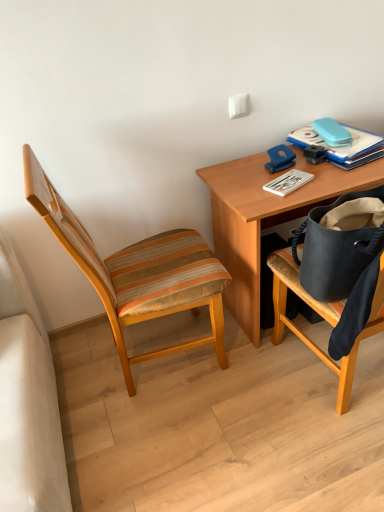
This screenshot has width=384, height=512. Describe the element at coordinates (265, 219) in the screenshot. I see `wooden desk at upper right` at that location.

What do you see at coordinates (137, 271) in the screenshot?
I see `wooden striped chair at left` at bounding box center [137, 271].

What are the coordinates of `wooden desk at upper right` in the screenshot? It's located at (265, 219).

Is point (157, 287) positioned after point (352, 139)?

That is False.

How many degrees apart are the facing directions of wooden striped chair at left and blue hardcover book at upper right, the first paperback book from the top?

They differ by 79.7 degrees in their facing directions.

Based on the photo, considering the sizes of objects wooden striped chair at left and blue hardcover book at upper right, placed as the 1th paperback book when sorted from right to left, in the image provided, who is thinner, wooden striped chair at left or blue hardcover book at upper right, placed as the 1th paperback book when sorted from right to left,?

Thinner between the two is blue hardcover book at upper right, placed as the 1th paperback book when sorted from right to left.

From a real-world perspective, is wooden striped chair at left above or below blue hardcover book at upper right, the first paperback book from the top?

wooden striped chair at left is below blue hardcover book at upper right, the first paperback book from the top.

Is blue hardcover book at upper right, placed as the 1th paperback book when sorted from right to left, facing towards white matte paperback book at upper right, positioned as the first paperback book in left-to-right order?

No, blue hardcover book at upper right, placed as the 1th paperback book when sorted from right to left, is not aimed at white matte paperback book at upper right, positioned as the first paperback book in left-to-right order.

Is blue hardcover book at upper right, placed as the 1th paperback book when sorted from right to left, further to the viewer compared to white matte paperback book at upper right, positioned as the first paperback book in left-to-right order?

Yes, blue hardcover book at upper right, placed as the 1th paperback book when sorted from right to left, is behind white matte paperback book at upper right, positioned as the first paperback book in left-to-right order.

From a real-world perspective, is blue hardcover book at upper right, the first paperback book from the top, below white matte paperback book at upper right, the second paperback book when ordered from right to left?

No, from a real-world perspective, blue hardcover book at upper right, the first paperback book from the top, is not beneath white matte paperback book at upper right, the second paperback book when ordered from right to left.

Does blue hardcover book at upper right, placed as the second paperback book when sorted from left to right, have a larger size compared to white matte paperback book at upper right, which is the 2th paperback book from top to bottom?

Yes, blue hardcover book at upper right, placed as the second paperback book when sorted from left to right, is bigger than white matte paperback book at upper right, which is the 2th paperback book from top to bottom.

Between white matte paperback book at upper right, which is the first paperback book from bottom to top, and wooden desk at upper right, which one appears on the left side from the viewer's perspective?

From the viewer's perspective, white matte paperback book at upper right, which is the first paperback book from bottom to top, appears more on the left side.

Does white matte paperback book at upper right, positioned as the first paperback book in left-to-right order, come behind wooden desk at upper right?

Yes, the depth of white matte paperback book at upper right, positioned as the first paperback book in left-to-right order, is greater than that of wooden desk at upper right.

Find the location of a particular element. The height and width of the screenshot is (512, 384). desk below the white matte paperback book at upper right, which is the 2th paperback book from top to bottom (from a real-world perspective) is located at coordinates (265, 219).

Consider the image. Between white matte paperback book at upper right, which is the first paperback book from bottom to top, and wooden desk at upper right, which one has larger size?

wooden desk at upper right.

Considering the relative sizes of white matte paperback book at upper right, which is the 2th paperback book from top to bottom, and blue hardcover book at upper right, placed as the second paperback book when sorted from left to right, in the image provided, is white matte paperback book at upper right, which is the 2th paperback book from top to bottom, taller than blue hardcover book at upper right, placed as the second paperback book when sorted from left to right,?

No, white matte paperback book at upper right, which is the 2th paperback book from top to bottom, is not taller than blue hardcover book at upper right, placed as the second paperback book when sorted from left to right.

Which object is positioned more to the left, white matte paperback book at upper right, positioned as the first paperback book in left-to-right order, or blue hardcover book at upper right, arranged as the 2th paperback book when ordered from the bottom?

From the viewer's perspective, white matte paperback book at upper right, positioned as the first paperback book in left-to-right order, appears more on the left side.

Is blue hardcover book at upper right, arranged as the 2th paperback book when ordered from the bottom, at the back of white matte paperback book at upper right, positioned as the first paperback book in left-to-right order?

No, blue hardcover book at upper right, arranged as the 2th paperback book when ordered from the bottom, is not at the back of white matte paperback book at upper right, positioned as the first paperback book in left-to-right order.

Considering the relative sizes of white matte paperback book at upper right, positioned as the first paperback book in left-to-right order, and wooden striped chair at left in the image provided, is white matte paperback book at upper right, positioned as the first paperback book in left-to-right order, taller than wooden striped chair at left?

Incorrect, the height of white matte paperback book at upper right, positioned as the first paperback book in left-to-right order, is not larger of that of wooden striped chair at left.

In the scene shown: From the image's perspective, does white matte paperback book at upper right, positioned as the first paperback book in left-to-right order, appear higher than wooden striped chair at left?

Yes, from the image's perspective, white matte paperback book at upper right, positioned as the first paperback book in left-to-right order, is on top of wooden striped chair at left.

How different are the orientations of white matte paperback book at upper right, positioned as the first paperback book in left-to-right order, and wooden striped chair at left in degrees?

The angular difference between white matte paperback book at upper right, positioned as the first paperback book in left-to-right order, and wooden striped chair at left is 20.1 degrees.

Which of these two, white matte paperback book at upper right, the second paperback book when ordered from right to left, or wooden striped chair at left, is bigger?

With larger size is wooden striped chair at left.

How different are the orientations of wooden desk at upper right and wooden striped chair at left in degrees?

The facing directions of wooden desk at upper right and wooden striped chair at left are 88.4 degrees apart.

Who is taller, wooden desk at upper right or wooden striped chair at left?

Standing taller between the two is wooden striped chair at left.

Between wooden desk at upper right and wooden striped chair at left, which one is positioned behind?

wooden desk at upper right is further away from the camera.

Is wooden striped chair at left wider than white matte paperback book at upper right, which is the first paperback book from bottom to top?

Indeed, wooden striped chair at left has a greater width compared to white matte paperback book at upper right, which is the first paperback book from bottom to top.

Is wooden striped chair at left to the left of white matte paperback book at upper right, which is the 2th paperback book from top to bottom, from the viewer's perspective?

Indeed, wooden striped chair at left is positioned on the left side of white matte paperback book at upper right, which is the 2th paperback book from top to bottom.

Is wooden striped chair at left inside the boundaries of white matte paperback book at upper right, which is the 2th paperback book from top to bottom, or outside?

wooden striped chair at left cannot be found inside white matte paperback book at upper right, which is the 2th paperback book from top to bottom.

From a real-world perspective, count 2nd paperback books upward from the wooden striped chair at left and point to it. Please provide its 2D coordinates.

[(342, 146)]

Image resolution: width=384 pixels, height=512 pixels. Identify the location of paperback book to the right of white matte paperback book at upper right, which is the first paperback book from bottom to top. (342, 146).

Considering their positions, is blue hardcover book at upper right, placed as the second paperback book when sorted from left to right, positioned closer to wooden desk at upper right than white matte paperback book at upper right, positioned as the first paperback book in left-to-right order?

white matte paperback book at upper right, positioned as the first paperback book in left-to-right order, is closer to wooden desk at upper right.

Estimate the real-world distances between objects in this image. Which object is further from wooden striped chair at left, wooden desk at upper right or white matte paperback book at upper right, which is the first paperback book from bottom to top?

The object further to wooden striped chair at left is white matte paperback book at upper right, which is the first paperback book from bottom to top.

Which object lies nearer to the anchor point wooden desk at upper right, wooden striped chair at left or blue hardcover book at upper right, placed as the second paperback book when sorted from left to right?

blue hardcover book at upper right, placed as the second paperback book when sorted from left to right, is closer to wooden desk at upper right.

Which object lies nearer to the anchor point blue hardcover book at upper right, placed as the 1th paperback book when sorted from right to left, wooden striped chair at left or wooden desk at upper right?

The object closer to blue hardcover book at upper right, placed as the 1th paperback book when sorted from right to left, is wooden desk at upper right.

Based on their spatial positions, is blue hardcover book at upper right, placed as the 1th paperback book when sorted from right to left, or wooden striped chair at left further from wooden desk at upper right?

Based on the image, wooden striped chair at left appears to be further to wooden desk at upper right.

Estimate the real-world distances between objects in this image. Which object is further from wooden striped chair at left, white matte paperback book at upper right, positioned as the first paperback book in left-to-right order, or wooden desk at upper right?

Among the two, white matte paperback book at upper right, positioned as the first paperback book in left-to-right order, is located further to wooden striped chair at left.

From the image, which object appears to be farther from wooden striped chair at left, blue hardcover book at upper right, the first paperback book from the top, or white matte paperback book at upper right, which is the 2th paperback book from top to bottom?

blue hardcover book at upper right, the first paperback book from the top, lies further to wooden striped chair at left than the other object.

From the image, which object appears to be farther from white matte paperback book at upper right, the second paperback book when ordered from right to left, wooden desk at upper right or wooden striped chair at left?

wooden striped chair at left.

The height and width of the screenshot is (512, 384). I want to click on paperback book between blue hardcover book at upper right, placed as the 1th paperback book when sorted from right to left, and wooden desk at upper right from top to bottom, so click(x=288, y=182).

You are a GUI agent. You are given a task and a screenshot of the screen. Output one action in this format:
    pyautogui.click(x=<x>, y=<y>)
    Task: Click on the paperback book located between wooden striped chair at left and wooden desk at upper right in the left-right direction
    The height and width of the screenshot is (512, 384).
    Given the screenshot: What is the action you would take?
    [x=288, y=182]

Locate an element on the screen. The width and height of the screenshot is (384, 512). desk between wooden striped chair at left and blue hardcover book at upper right, placed as the 1th paperback book when sorted from right to left, from left to right is located at coordinates (265, 219).

You are a GUI agent. You are given a task and a screenshot of the screen. Output one action in this format:
    pyautogui.click(x=<x>, y=<y>)
    Task: Click on the paperback book between wooden striped chair at left and blue hardcover book at upper right, placed as the second paperback book when sorted from left to right
    The height and width of the screenshot is (512, 384).
    Given the screenshot: What is the action you would take?
    pyautogui.click(x=288, y=182)